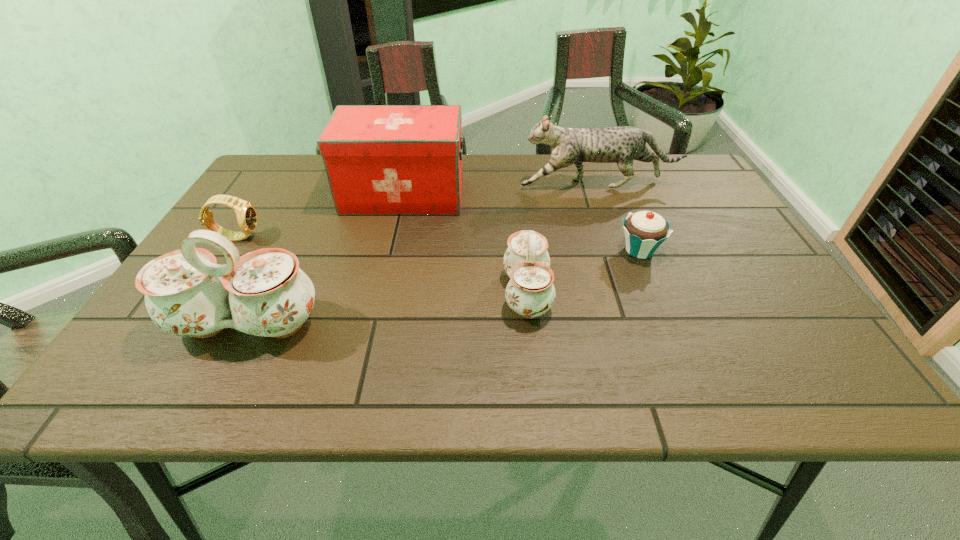
Observe the arrangement of all chinawares in the image. To keep them evenly spaced, where would you place another chinaware on the right? Please locate a free space. Please provide its 2D coordinates. Your answer should be formatted as a tuple, i.e. [(x, y)], where the tuple contains the x and y coordinates of a point satisfying the conditions above.

[(771, 265)]